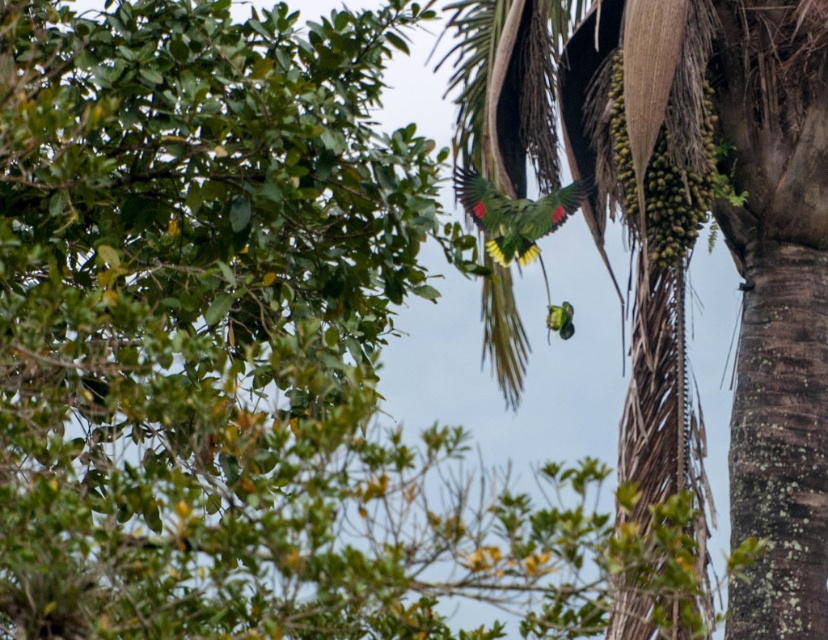
You are standing at the center of the image and want to locate the green leafy coconut tree at upper right. Based on the coordinates provided, in which direction should you look to find it?

The green leafy coconut tree at upper right is located at coordinates point (739, 272), so you should look to the upper right direction to find it.

You are a drone operator trying to capture a photo of the green leafy coconut tree at upper right. You notice a point marked at coordinates (739, 272) in the image. Based on the scene description, can you confirm if this point is located on the green leafy coconut tree at upper right?

Yes, the point at coordinates (739, 272) corresponds to the green leafy coconut tree at upper right, so it is located on that tree.

You are an ornithologist observing the green matte parrot at center and the green leafy coconut tree at upper right. Which object has a greater width according to the scene?

The green leafy coconut tree at upper right has a greater width than the green matte parrot at center.